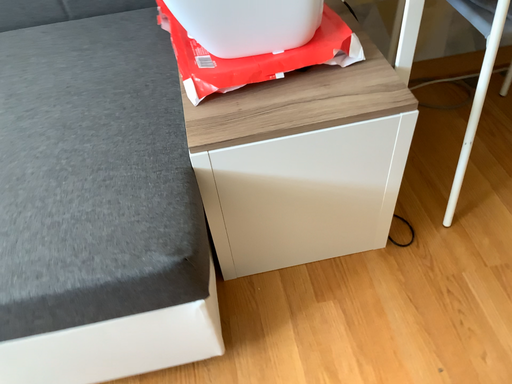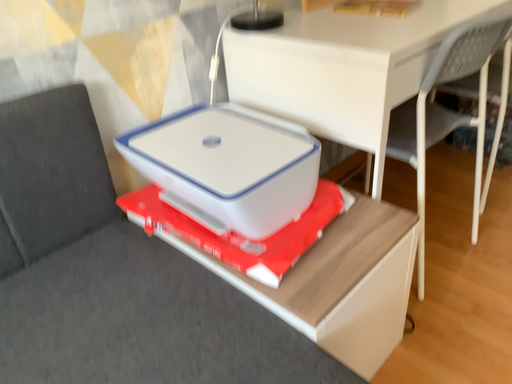
Question: Which way did the camera rotate in the video?

Choices:
 (A) rotated left
 (B) rotated right

Answer: (B)